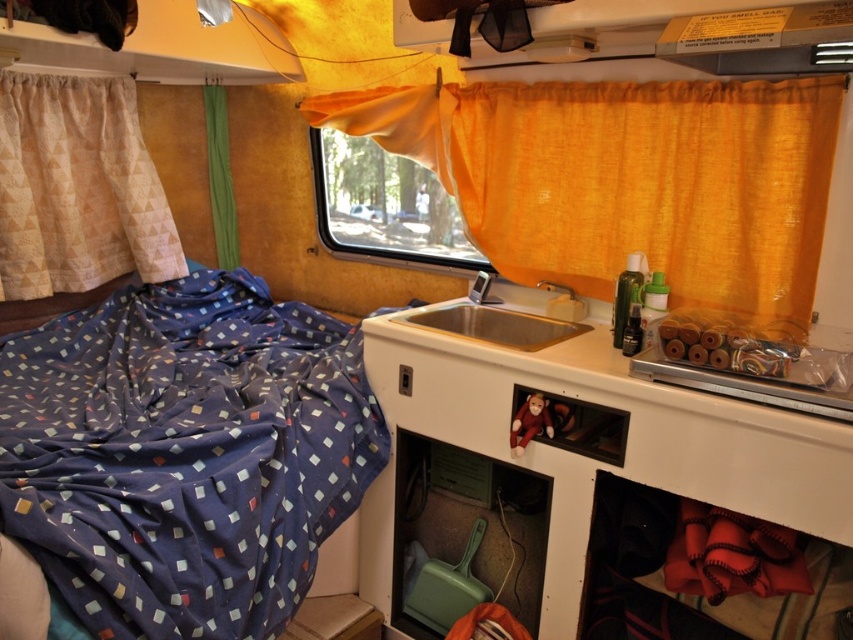
Question: Is beige textured curtain at left bigger than satin silver sink at center?

Choices:
 (A) no
 (B) yes

Answer: (B)

Question: Which object is closer to the camera taking this photo?

Choices:
 (A) satin silver sink at center
 (B) orange fabric window at center
 (C) blue printed fabric bed at left
 (D) orange sheer curtain at upper center

Answer: (C)

Question: Is orange sheer curtain at upper center positioned in front of satin silver sink at center?

Choices:
 (A) yes
 (B) no

Answer: (A)

Question: Observing the image, what is the correct spatial positioning of orange fabric window at center in reference to satin silver sink at center?

Choices:
 (A) right
 (B) left

Answer: (B)

Question: Which is farther from the satin silver sink at center?

Choices:
 (A) beige textured curtain at left
 (B) orange sheer curtain at upper center
 (C) blue printed fabric bed at left

Answer: (A)

Question: Which object is closer to the camera taking this photo?

Choices:
 (A) blue printed fabric bed at left
 (B) orange sheer curtain at upper center

Answer: (A)